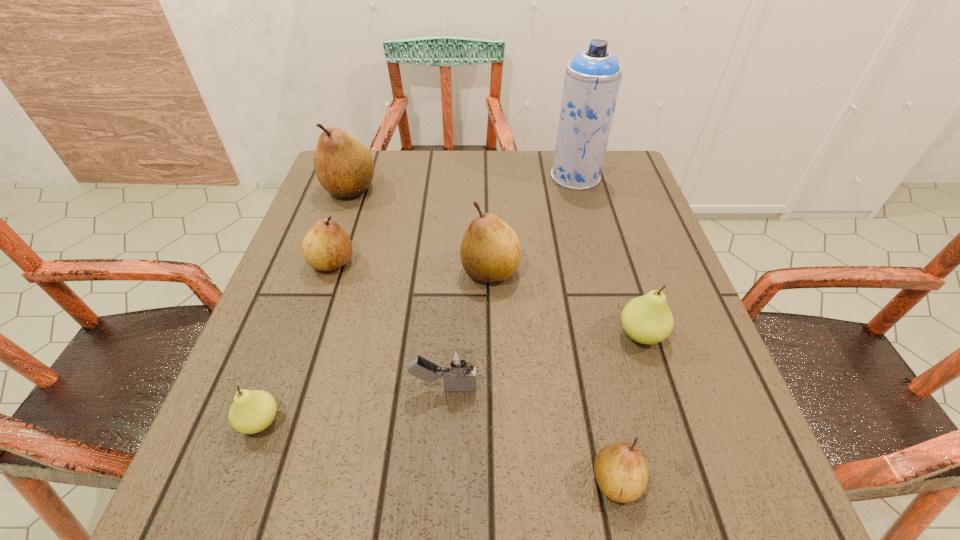
Locate an element on the screen. The image size is (960, 540). vacant space that satisfies the following two spatial constraints: 1. on the back side of the third nearest pear; 2. on the left side of the fifth pear from left to right is located at coordinates (586, 334).

Locate an element on the screen. This screenshot has height=540, width=960. free spot that satisfies the following two spatial constraints: 1. on the front side of the second pear from right to left; 2. on the left side of the tallest pear is located at coordinates (247, 481).

In order to click on blank area in the image that satisfies the following two spatial constraints: 1. on the front side of the bigger green pear; 2. on the right side of the tallest object in this screenshot , I will do `click(618, 334)`.

Find the location of a particular element. free point that satisfies the following two spatial constraints: 1. on the back side of the third pear from right to left; 2. on the right side of the nearer green pear is located at coordinates (316, 271).

This screenshot has width=960, height=540. What are the coordinates of `vacant point that satisfies the following two spatial constraints: 1. on the back side of the nearer green pear; 2. on the left side of the second smallest brown pear` in the screenshot? It's located at (319, 263).

Identify the location of free location that satisfies the following two spatial constraints: 1. on the front side of the second pear from right to left; 2. on the right side of the biggest brown pear. (247, 481).